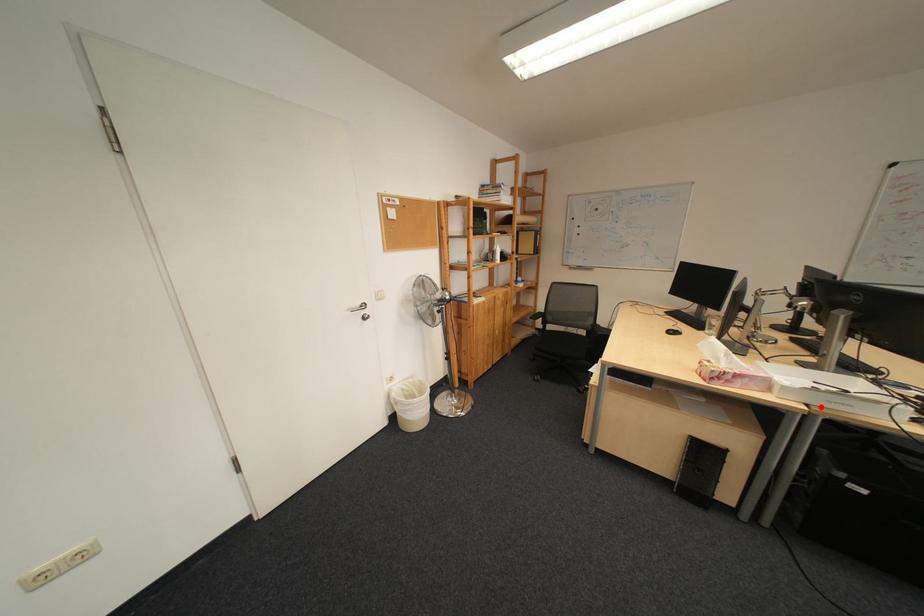
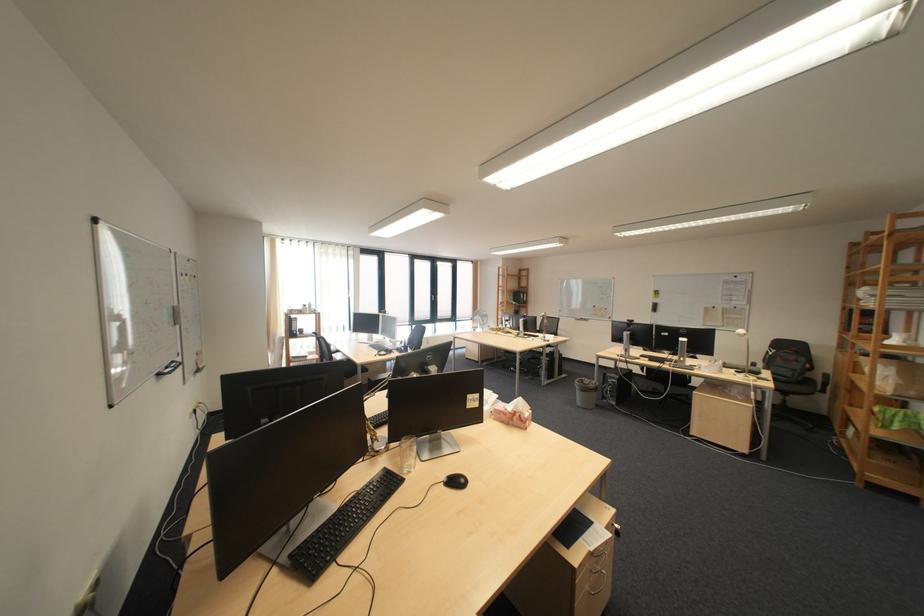
Question: I am providing you with two images of the same scene from different viewpoints. A red point is marked on the first image. At the location where the point appears in image 1, is it still visible in image 2?

Choices:
 (A) Yes
 (B) No

Answer: (B)